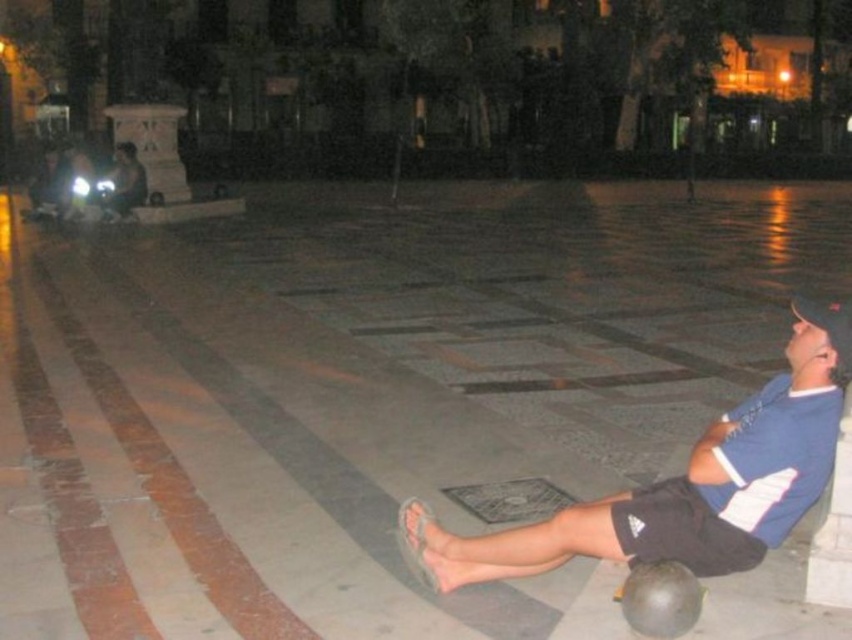
You are planning to walk across the gray concrete pavement at center while avoiding the blue cotton shirt at center. Since you need to know which is wider to choose the safest path, can you determine which object is wider?

The gray concrete pavement at center is wider than the blue cotton shirt at center, so the safest path would be the gray concrete pavement at center.

You are standing in the plaza and want to place a small potted plant on the gray concrete pavement at center without it being on the blue cotton shirt at center. Is this possible?

Yes, because the gray concrete pavement at center is located above the blue cotton shirt at center, so placing the plant on the pavement would not involve the shirt.

You are standing in the plaza and want to walk from the gray concrete pavement at center to the blue cotton shirt at center. Which direction should you move?

To move from the gray concrete pavement at center to the blue cotton shirt at center, you should move to the left, since the gray concrete pavement at center is to the right of the blue cotton shirt at center.